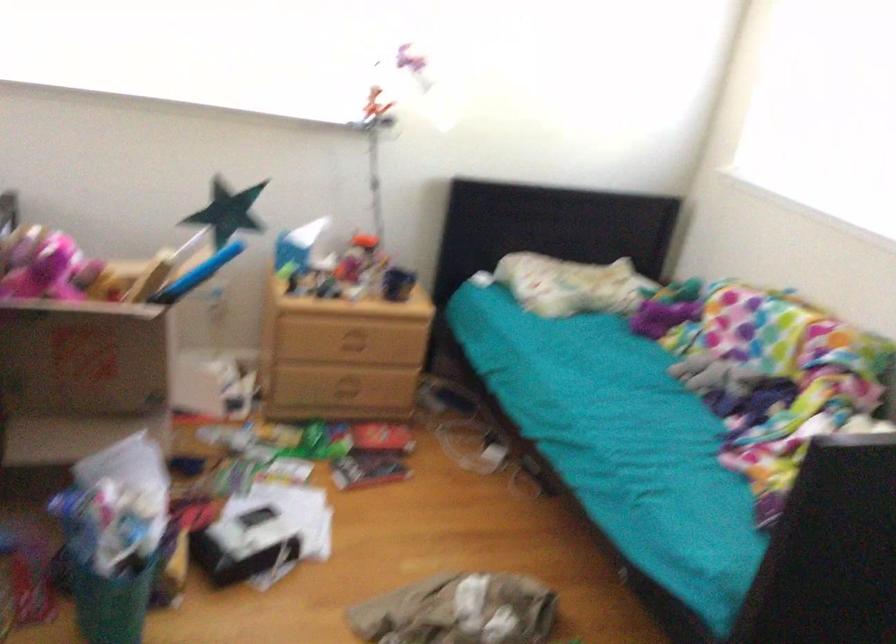
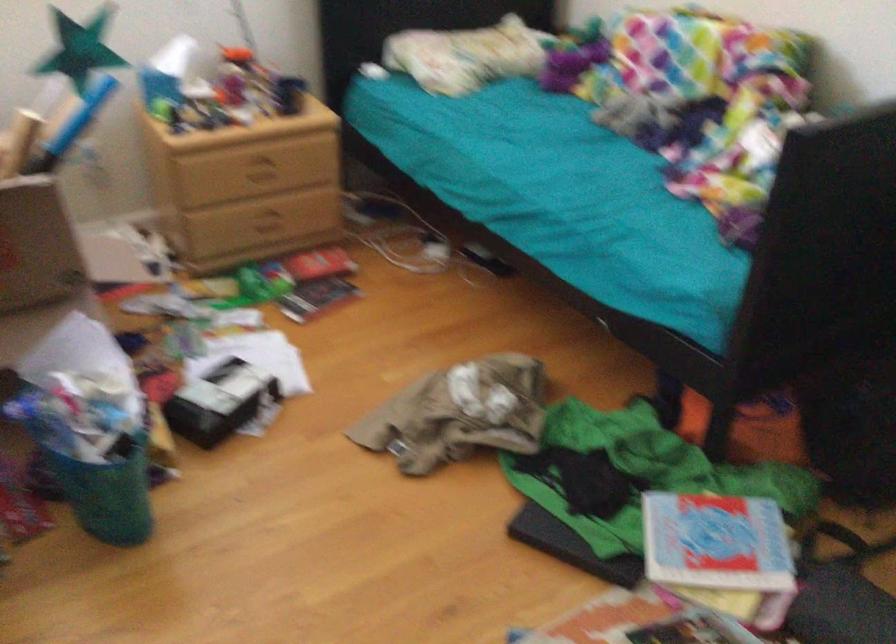
Find the pixel in the second image that matches (358,343) in the first image.

(266, 172)